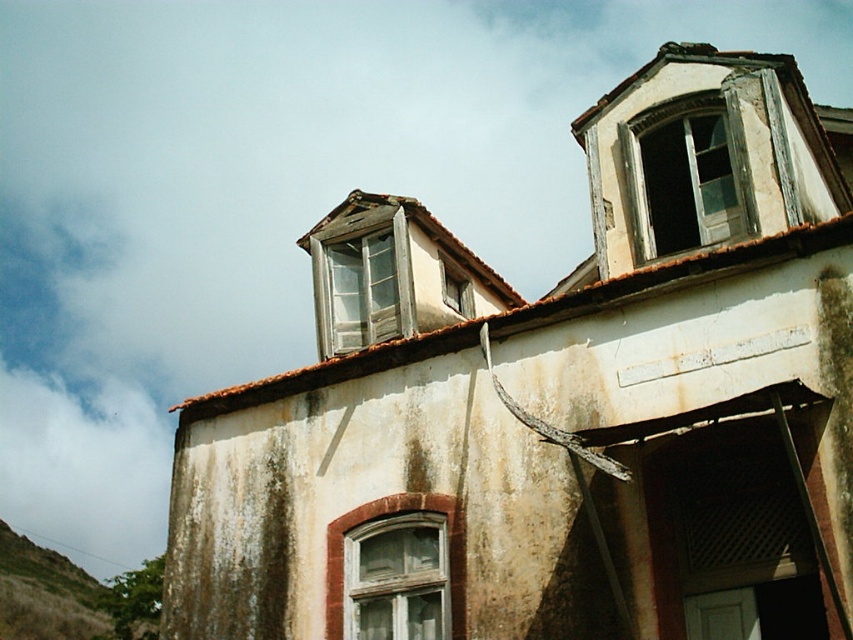
Which is behind, point (386, 554) or point (442, 256)?

The point (442, 256) is behind.

From the picture: Which is more to the right, wooden window at center or matte glass window at upper center?

Positioned to the right is matte glass window at upper center.

Find the location of a particular element. The height and width of the screenshot is (640, 853). wooden window at center is located at coordinates (396, 579).

At what (x,y) coordinates should I click in order to perform the action: click on wooden window at center. Please return your answer as a coordinate pair (x, y). The height and width of the screenshot is (640, 853). Looking at the image, I should click on (396, 579).

Which is more to the right, transparent glass window at center or wooden window at center?

wooden window at center is more to the right.

Is transparent glass window at center smaller than wooden window at center?

Incorrect, transparent glass window at center is not smaller in size than wooden window at center.

Measure the distance between transparent glass window at center and camera.

20.45 meters

At what (x,y) coordinates should I click in order to perform the action: click on transparent glass window at center. Please return your answer as a coordinate pair (x, y). This screenshot has height=640, width=853. Looking at the image, I should click on (361, 280).

In the scene shown: Which of these two, transparent glass window at center or matte glass window at upper center, stands taller?

transparent glass window at center is taller.

Which is above, transparent glass window at center or matte glass window at upper center?

matte glass window at upper center is above.

What do you see at coordinates (361, 280) in the screenshot?
I see `transparent glass window at center` at bounding box center [361, 280].

At what (x,y) coordinates should I click in order to perform the action: click on transparent glass window at center. Please return your answer as a coordinate pair (x, y). Looking at the image, I should click on (361, 280).